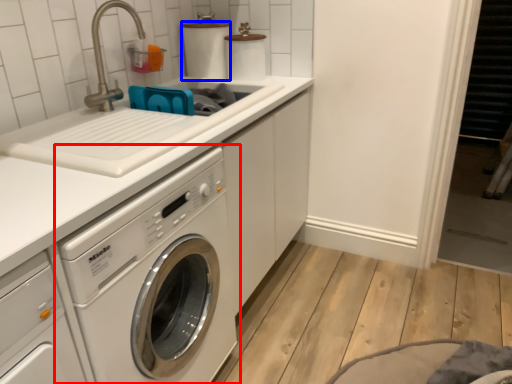
Question: Which object appears closest to the camera in this image, washing machine (highlighted by a red box) or toilet paper (highlighted by a blue box)?

Choices:
 (A) washing machine
 (B) toilet paper

Answer: (A)